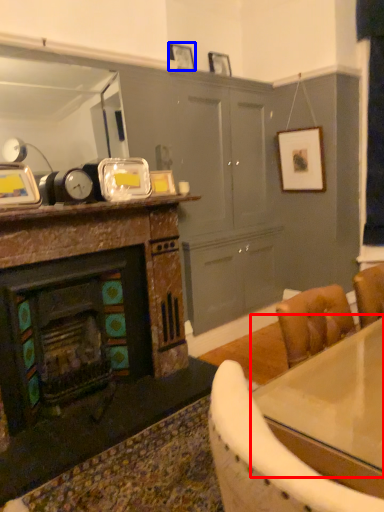
Question: Among these objects, which one is farthest to the camera, counter top (highlighted by a red box) or picture frame (highlighted by a blue box)?

Choices:
 (A) counter top
 (B) picture frame

Answer: (B)